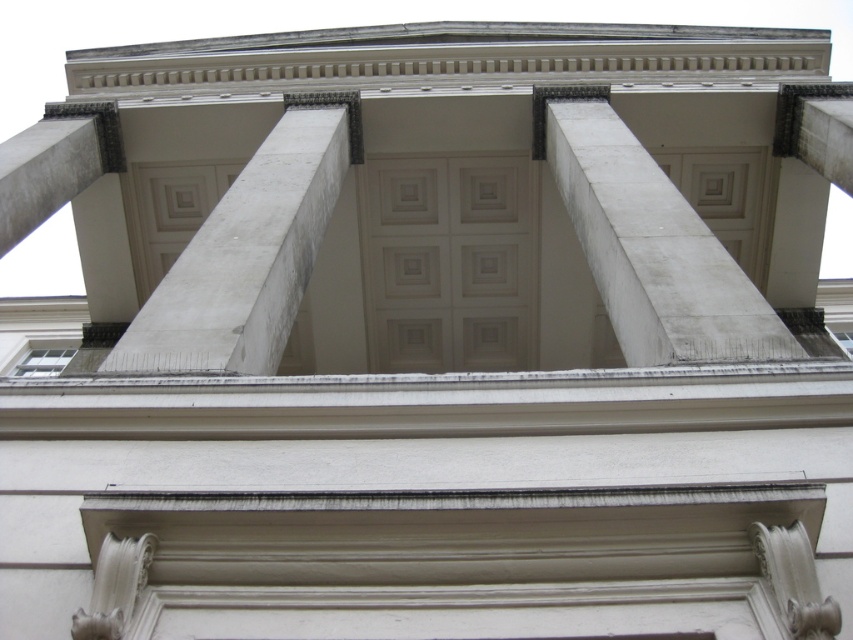
Question: Among these objects, which one is nearest to the camera?

Choices:
 (A) white marble pillar at center
 (B) white concrete column at center

Answer: (A)

Question: Does white concrete column at center have a larger size compared to white marble pillar at center?

Choices:
 (A) yes
 (B) no

Answer: (A)

Question: Which object appears closest to the camera in this image?

Choices:
 (A) white concrete column at center
 (B) white marble pillar at center

Answer: (B)

Question: Can you confirm if white concrete column at center is positioned to the right of white marble pillar at center?

Choices:
 (A) yes
 (B) no

Answer: (A)

Question: Which object appears farthest from the camera in this image?

Choices:
 (A) white marble pillar at center
 (B) white concrete column at center

Answer: (B)

Question: Does white concrete column at center come behind white marble pillar at center?

Choices:
 (A) yes
 (B) no

Answer: (A)